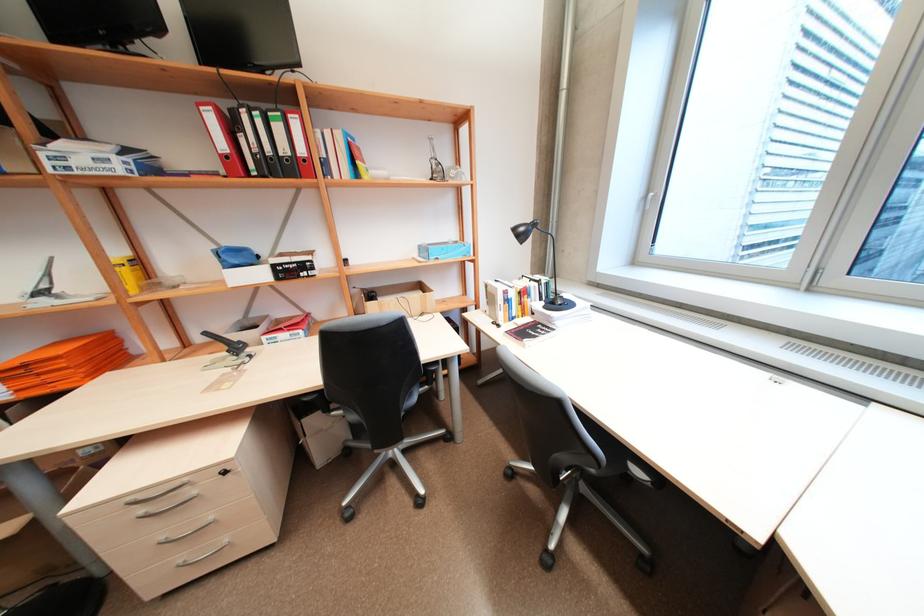
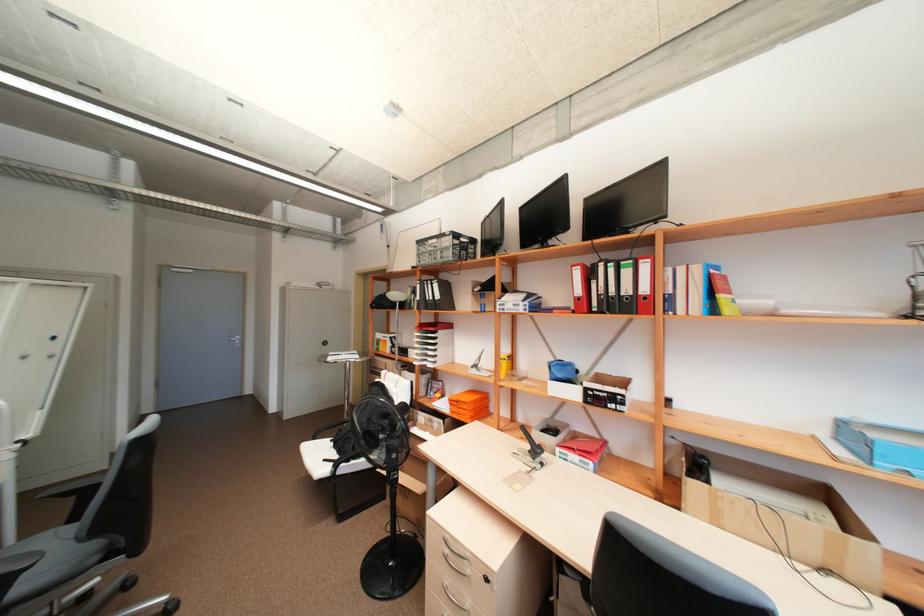
Find the pixel in the second image that matches point 253,323 in the first image.

(557, 424)